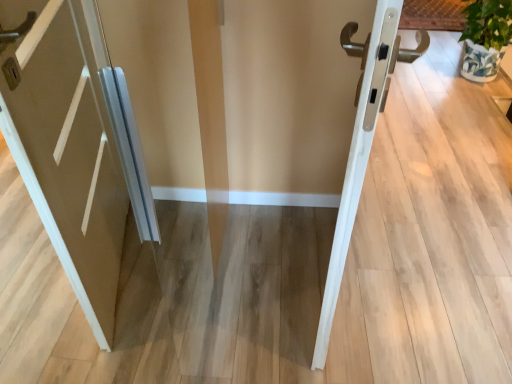
This screenshot has height=384, width=512. Describe the element at coordinates (74, 143) in the screenshot. I see `matte white door at center` at that location.

You are a GUI agent. You are given a task and a screenshot of the screen. Output one action in this format:
    pyautogui.click(x=<x>, y=<y>)
    Task: Click on the matte white door at center
    Image resolution: width=512 pixels, height=384 pixels.
    Given the screenshot: What is the action you would take?
    pyautogui.click(x=74, y=143)

In order to face matte white door at center, should I rotate leftwards or rightwards?

Turn left approximately 18.590 degrees to face it.

This screenshot has height=384, width=512. I want to click on matte white door at center, so click(74, 143).